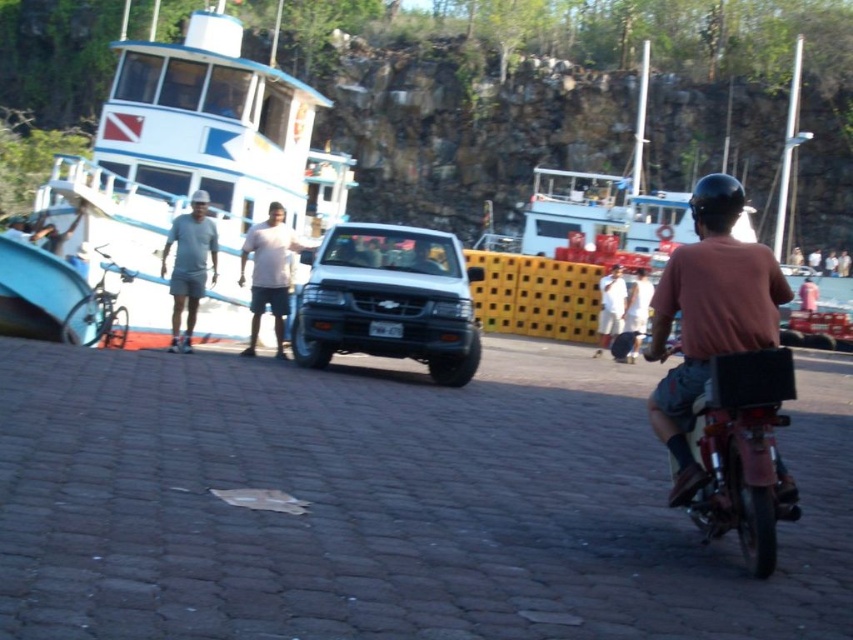
Is white glossy boat at upper left below brown matte shirt at right?

Actually, white glossy boat at upper left is above brown matte shirt at right.

Who is lower down, white glossy boat at upper left or brown matte shirt at right?

brown matte shirt at right

Who is more distant from viewer, [142,118] or [734,289]?

The point [142,118] is more distant.

Where is `white glossy boat at upper left`? The width and height of the screenshot is (853, 640). white glossy boat at upper left is located at coordinates (193, 164).

This screenshot has width=853, height=640. I want to click on metallic red motorcycle at right, so click(x=741, y=451).

Does metallic red motorcycle at right have a smaller size compared to white matte shirt at center?

Yes.

What do you see at coordinates (741, 451) in the screenshot?
I see `metallic red motorcycle at right` at bounding box center [741, 451].

Where is `metallic red motorcycle at right`? This screenshot has width=853, height=640. metallic red motorcycle at right is located at coordinates (741, 451).

From the picture: Who is more distant from viewer, (227, 205) or (598, 284)?

The point (598, 284) is more distant.

Does white glossy boat at upper left have a greater height compared to white matte shirt at center?

Yes.

What do you see at coordinates (193, 164) in the screenshot? I see `white glossy boat at upper left` at bounding box center [193, 164].

The image size is (853, 640). Identify the location of white glossy boat at upper left. (193, 164).